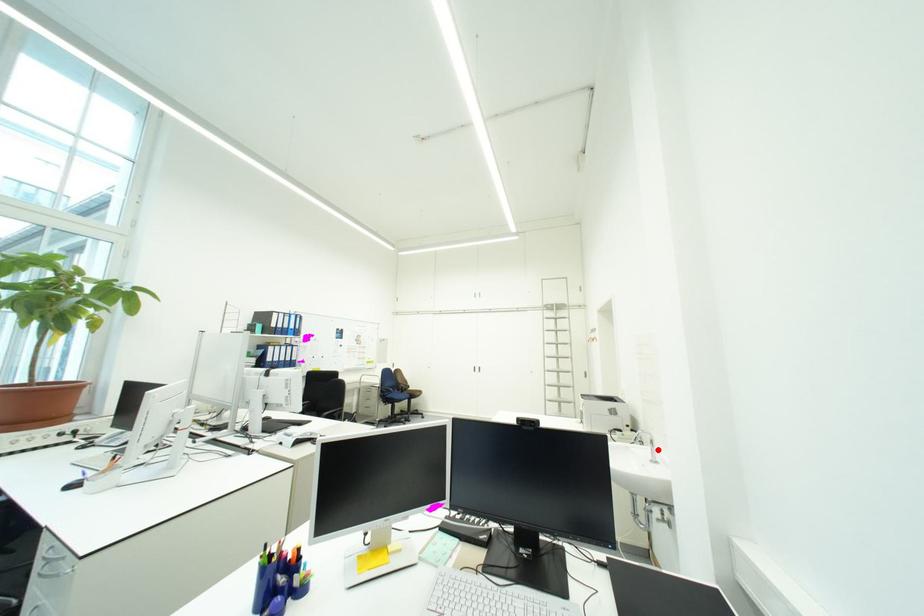
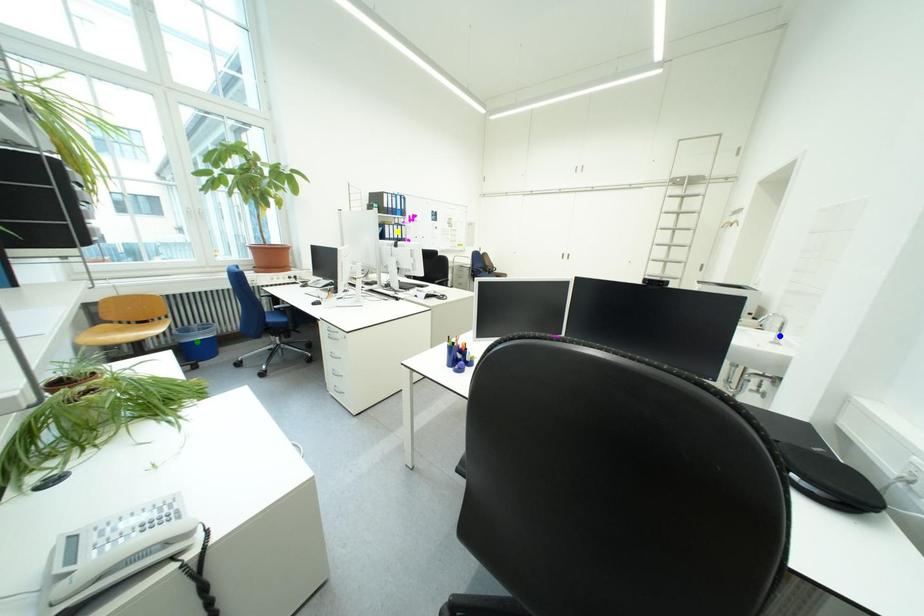
Question: I am providing you with two images of the same scene from different viewpoints. A red point is marked on the first image. You are given multiple points on the second image. In image 2, which mark is for the same physical point as the one in image 1?

Choices:
 (A) green point
 (B) yellow point
 (C) blue point

Answer: (C)